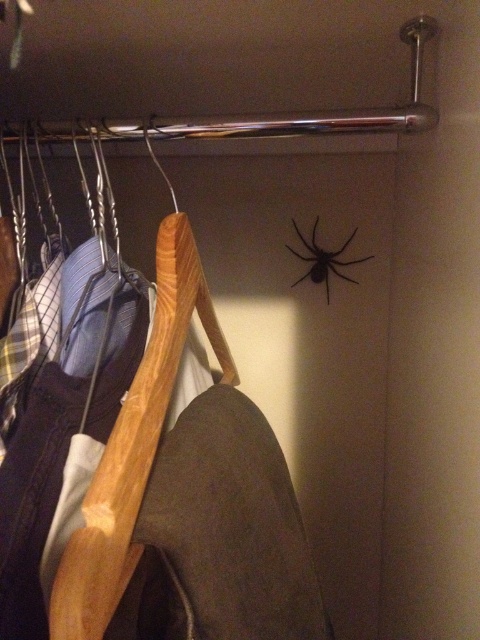
Question: Which point appears closest to the camera in this image?

Choices:
 (A) (325, 257)
 (B) (120, 378)

Answer: (B)

Question: Which object is closer to the camera taking this photo?

Choices:
 (A) black matte spider at upper center
 (B) wooden hanger at left

Answer: (B)

Question: Can you confirm if wooden hanger at left is smaller than black matte spider at upper center?

Choices:
 (A) no
 (B) yes

Answer: (A)

Question: Does wooden hanger at left appear under black matte spider at upper center?

Choices:
 (A) yes
 (B) no

Answer: (A)

Question: From the image, what is the correct spatial relationship of wooden hanger at left in relation to black matte spider at upper center?

Choices:
 (A) above
 (B) below

Answer: (B)